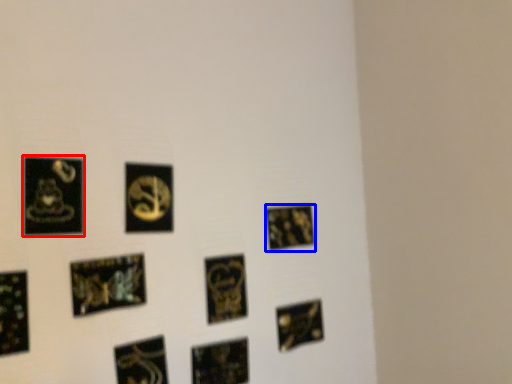
Question: Among these objects, which one is nearest to the camera, picture frame (highlighted by a red box) or picture frame (highlighted by a blue box)?

Choices:
 (A) picture frame
 (B) picture frame

Answer: (A)